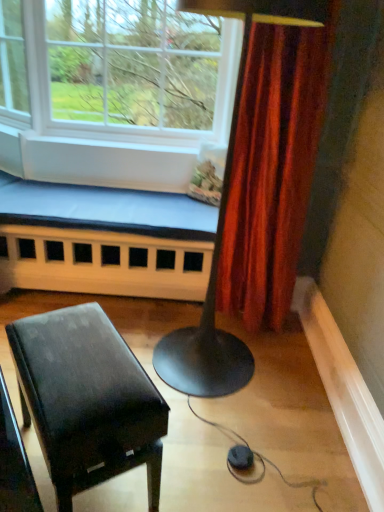
Question: Considering the relative sizes of clear glass window at upper left and glossy black piano at lower left in the image provided, is clear glass window at upper left taller than glossy black piano at lower left?

Choices:
 (A) yes
 (B) no

Answer: (A)

Question: From a real-world perspective, does clear glass window at upper left stand above glossy black piano at lower left?

Choices:
 (A) no
 (B) yes

Answer: (B)

Question: Does clear glass window at upper left lie in front of glossy black piano at lower left?

Choices:
 (A) no
 (B) yes

Answer: (A)

Question: Is clear glass window at upper left wider than glossy black piano at lower left?

Choices:
 (A) yes
 (B) no

Answer: (A)

Question: Is clear glass window at upper left thinner than glossy black piano at lower left?

Choices:
 (A) no
 (B) yes

Answer: (A)

Question: Is clear glass window at upper left bigger or smaller than glossy black piano at lower left?

Choices:
 (A) big
 (B) small

Answer: (A)

Question: Considering the relative positions of clear glass window at upper left and glossy black piano at lower left in the image provided, is clear glass window at upper left to the left or to the right of glossy black piano at lower left?

Choices:
 (A) right
 (B) left

Answer: (B)

Question: Which is correct: clear glass window at upper left is inside glossy black piano at lower left, or outside of it?

Choices:
 (A) inside
 (B) outside

Answer: (B)

Question: Is point (183, 125) positioned closer to the camera than point (130, 352)?

Choices:
 (A) farther
 (B) closer

Answer: (A)

Question: Considering the positions of point (39, 203) and point (157, 496), is point (39, 203) closer or farther from the camera than point (157, 496)?

Choices:
 (A) closer
 (B) farther

Answer: (B)

Question: Choose the correct answer: Is white wood church bench at lower left inside glossy black piano at lower left or outside it?

Choices:
 (A) outside
 (B) inside

Answer: (A)

Question: In the image, is white wood church bench at lower left on the left side or the right side of glossy black piano at lower left?

Choices:
 (A) left
 (B) right

Answer: (A)

Question: Considering the positions of white wood church bench at lower left and glossy black piano at lower left in the image, is white wood church bench at lower left wider or thinner than glossy black piano at lower left?

Choices:
 (A) wide
 (B) thin

Answer: (A)

Question: Considering the positions of clear glass window at upper left and white wood church bench at lower left in the image, is clear glass window at upper left taller or shorter than white wood church bench at lower left?

Choices:
 (A) short
 (B) tall

Answer: (B)

Question: Relative to white wood church bench at lower left, is clear glass window at upper left in front or behind?

Choices:
 (A) behind
 (B) front

Answer: (B)